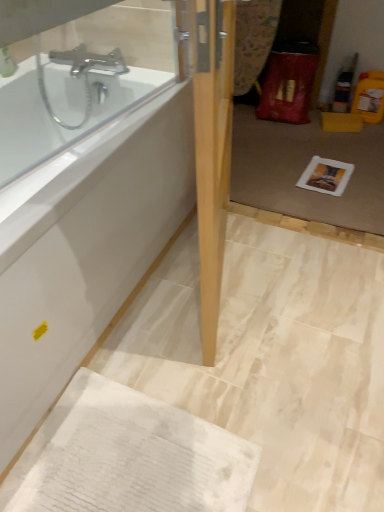
At what (x,y) coordinates should I click in order to perform the action: click on vacant space in front of light wood door at center. Please return your answer as a coordinate pair (x, y). The image size is (384, 512). Looking at the image, I should click on (250, 369).